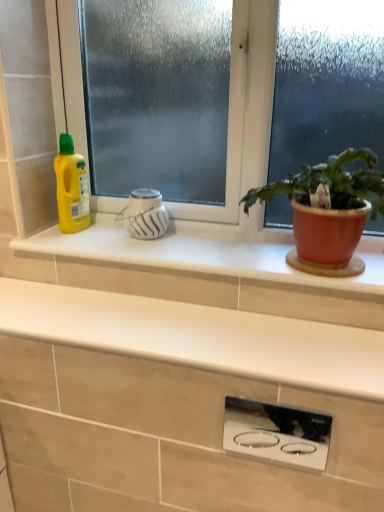
Image resolution: width=384 pixels, height=512 pixels. I want to click on vacant space that's between matte terracotta pot at right and white glossy vase at center, the first appliance positioned from the back, so click(191, 250).